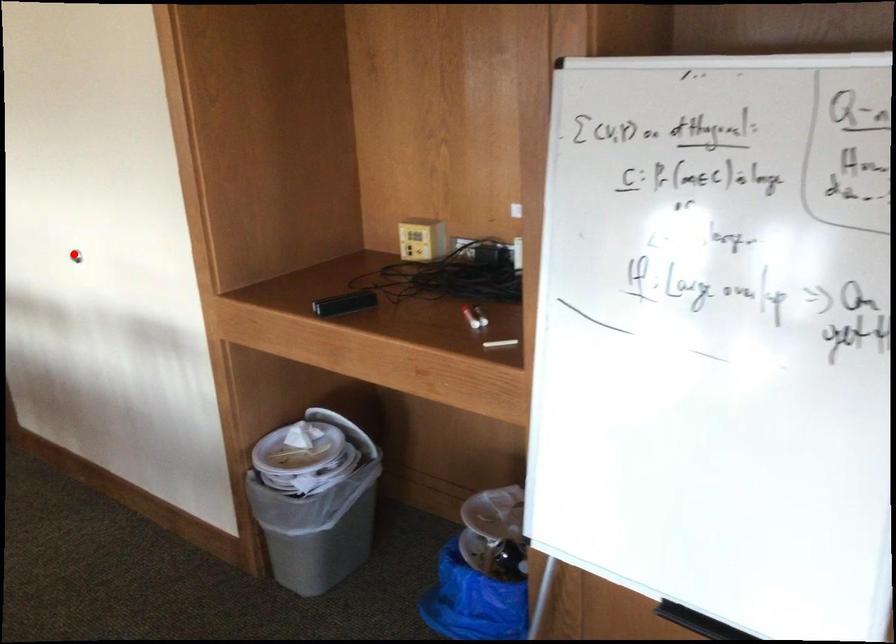
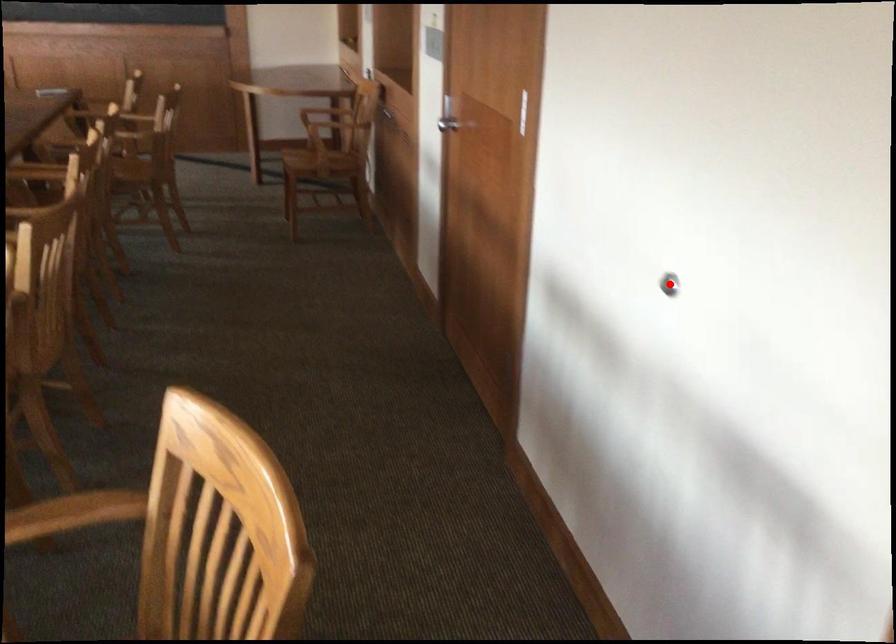
I am providing you with two images of the same scene from different viewpoints. A red point is marked on the first image and another point is marked on the second image. Are the points marked in image1 and image2 representing the same 3D position?

Yes